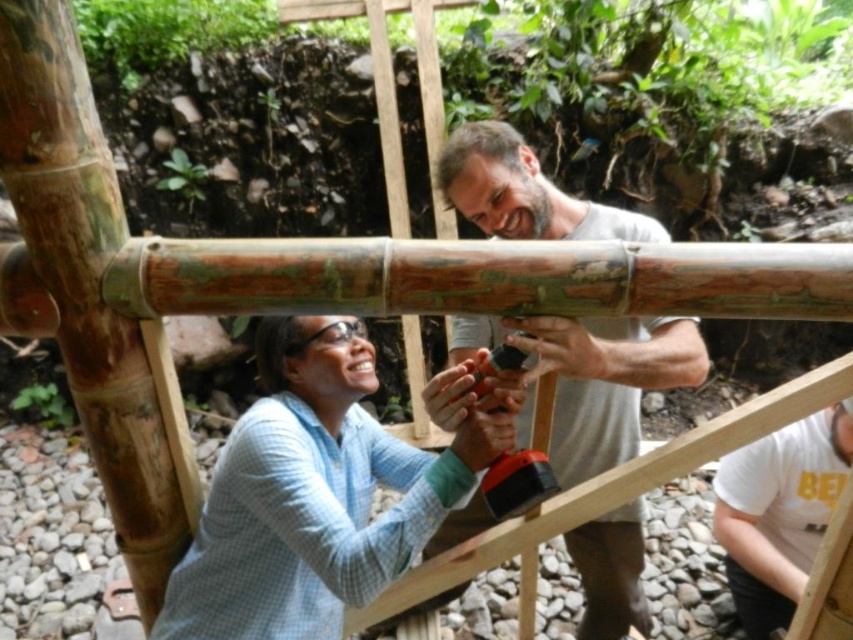
Question: Can you confirm if light blue checkered shirt at center is thinner than smooth gray shirt at center?

Choices:
 (A) yes
 (B) no

Answer: (B)

Question: Does light blue checkered shirt at center appear on the right side of smooth gray shirt at center?

Choices:
 (A) yes
 (B) no

Answer: (B)

Question: Which point appears farthest from the camera in this image?

Choices:
 (A) (612, 353)
 (B) (296, 600)

Answer: (B)

Question: Which object is farther from the camera taking this photo?

Choices:
 (A) smooth gray shirt at center
 (B) light blue checkered shirt at center

Answer: (B)

Question: From the image, what is the correct spatial relationship of light blue checkered shirt at center in relation to smooth gray shirt at center?

Choices:
 (A) above
 (B) below

Answer: (A)